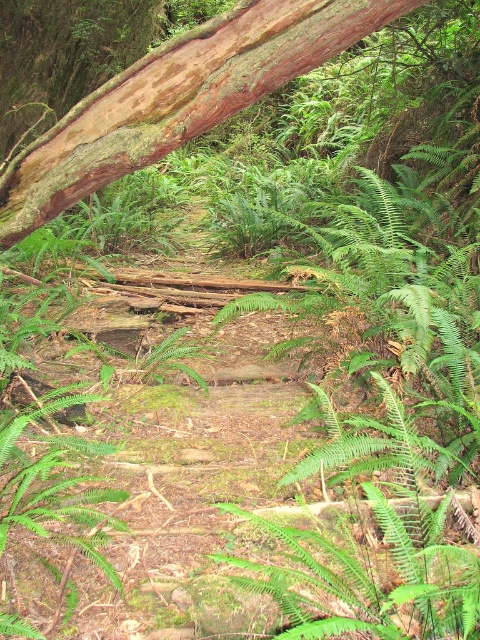
You are a hiker who wants to cross the path in the forest. You see the brown rough bark tree trunk at upper left and the green leafy fern at lower left. Which object is bigger and might block your way more?

The brown rough bark tree trunk at upper left is larger in size than the green leafy fern at lower left, so it might block your way more.

From the picture: You are a hiker who wants to take a photo of the green leafy fern at center without the brown rough bark tree trunk at upper left blocking the view. Is it possible to move to a position where the fern is visible without the trunk in front of it?

The green leafy fern at center is behind the brown rough bark tree trunk at upper left, so moving around the trunk might allow you to see the fern without the trunk blocking the view. However, since the trunk is in front of the fern from the current perspective, you would need to find a position where you can see around or past the trunk to capture the fern without obstruction.

You are a hiker who wants to take a photo of both the green leafy fern at center and the green leafy fern at lower left. Which fern should you stand closer to in order to capture both in the same frame?

You should stand closer to the green leafy fern at lower left because it is shorter than the green leafy fern at center, allowing both to be captured in the same frame when positioned appropriately.